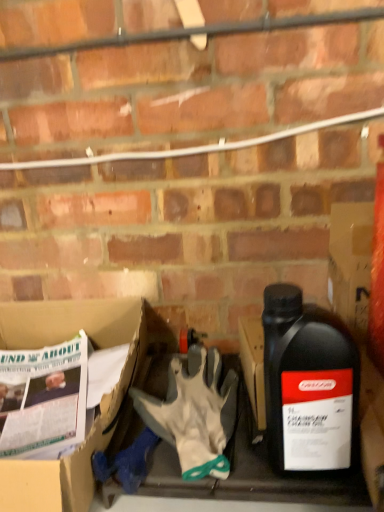
I want to click on vacant space that is in between black plastic bottle at right and white fabric glove at center, so click(245, 441).